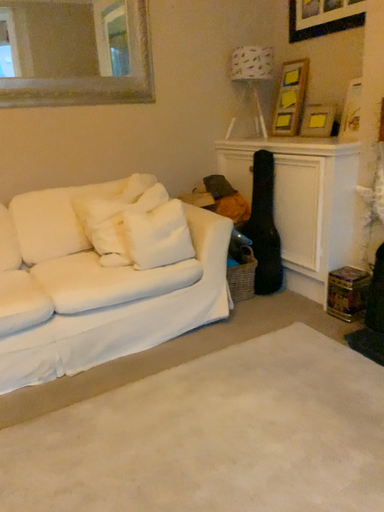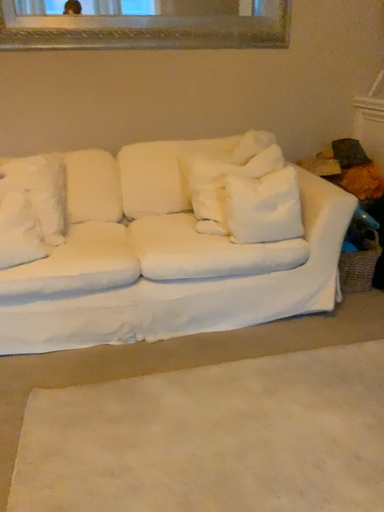
Question: How did the camera likely rotate when shooting the video?

Choices:
 (A) rotated left
 (B) rotated right

Answer: (A)